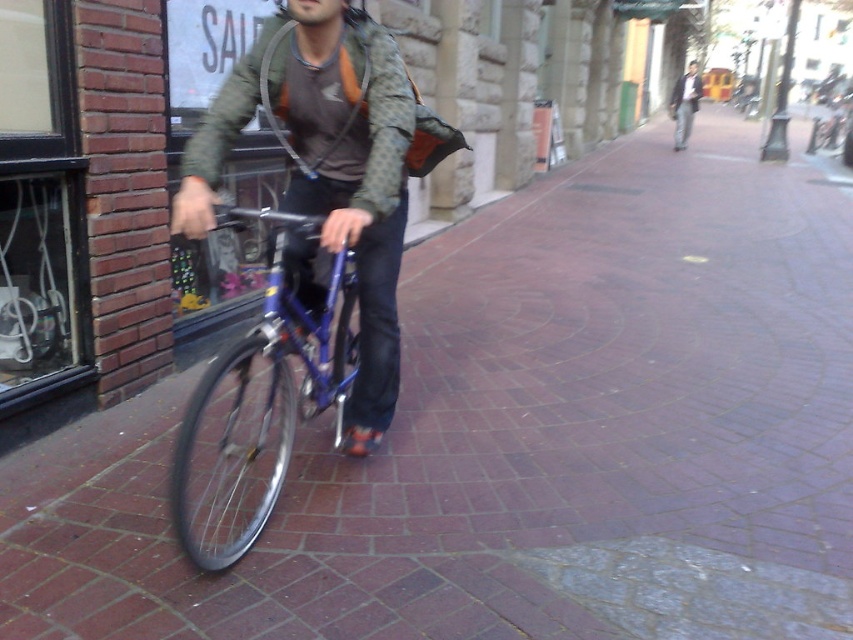
Where is `shiny blue bicycle at center`? This screenshot has width=853, height=640. shiny blue bicycle at center is located at coordinates (267, 387).

Does shiny blue bicycle at center appear on the left side of dark gray jacket at upper center?

Correct, you'll find shiny blue bicycle at center to the left of dark gray jacket at upper center.

You are a GUI agent. You are given a task and a screenshot of the screen. Output one action in this format:
    pyautogui.click(x=<x>, y=<y>)
    Task: Click on the shiny blue bicycle at center
    
    Given the screenshot: What is the action you would take?
    pyautogui.click(x=267, y=387)

Is dark gray jacket at upper center in front of brown fabric helmet at center?

No, it is behind brown fabric helmet at center.

Which is behind, point (692, 74) or point (345, 17)?

Point (692, 74)

This screenshot has width=853, height=640. I want to click on dark gray jacket at upper center, so click(x=685, y=104).

Does point (364, 275) come behind point (231, 481)?

No, it is not.

This screenshot has height=640, width=853. What do you see at coordinates (352, 180) in the screenshot?
I see `matte blue bicycle at center` at bounding box center [352, 180].

Which is behind, point (277, 42) or point (231, 556)?

Positioned behind is point (277, 42).

The image size is (853, 640). Find the location of `matte blue bicycle at center`. matte blue bicycle at center is located at coordinates pyautogui.click(x=352, y=180).